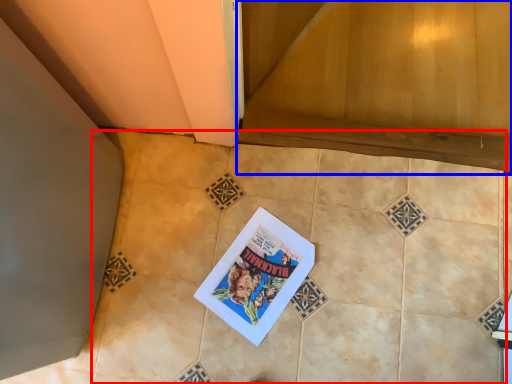
Question: Among these objects, which one is farthest to the camera, ceramic tile (highlighted by a red box) or stairwell (highlighted by a blue box)?

Choices:
 (A) ceramic tile
 (B) stairwell

Answer: (B)